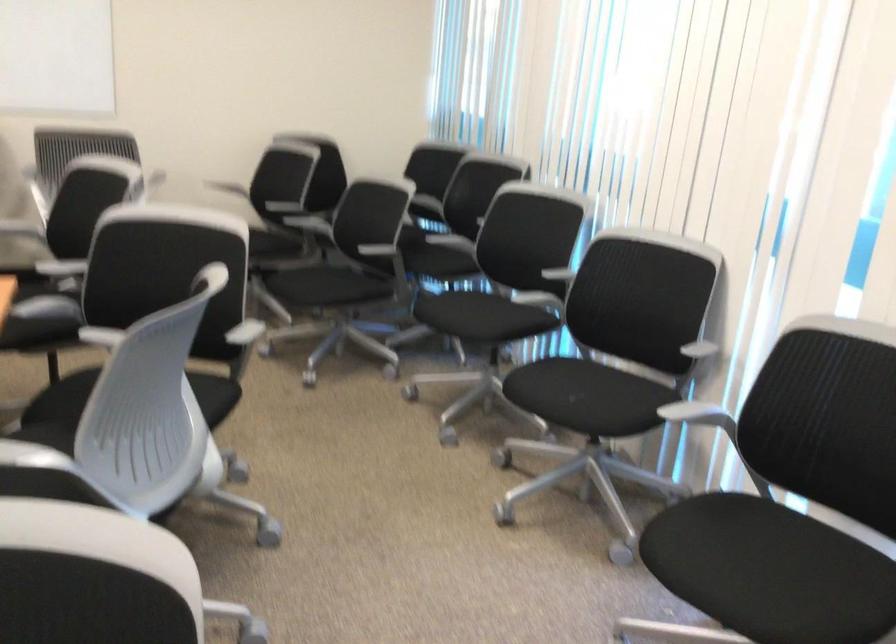
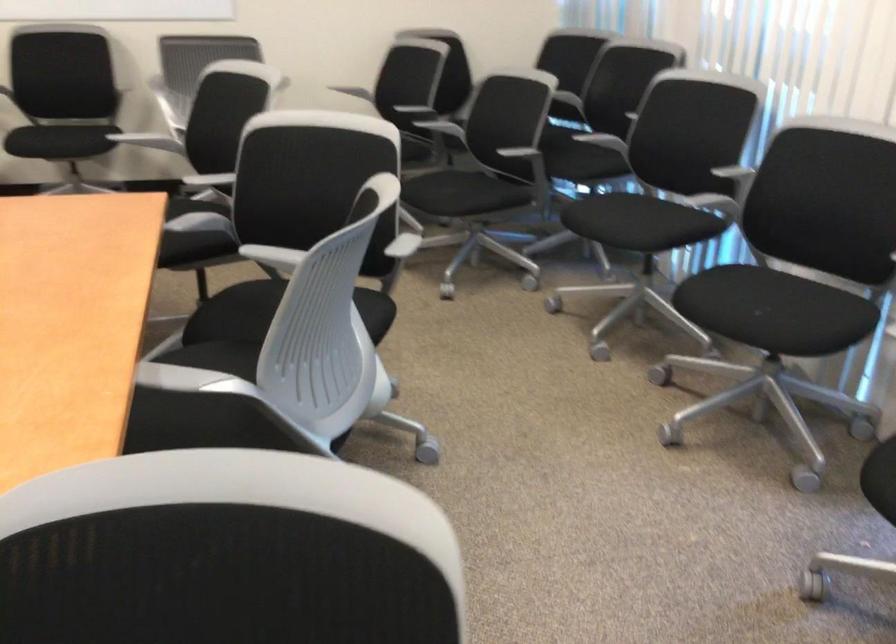
In the second image, find the point that corresponds to point (302, 205) in the first image.

(432, 107)